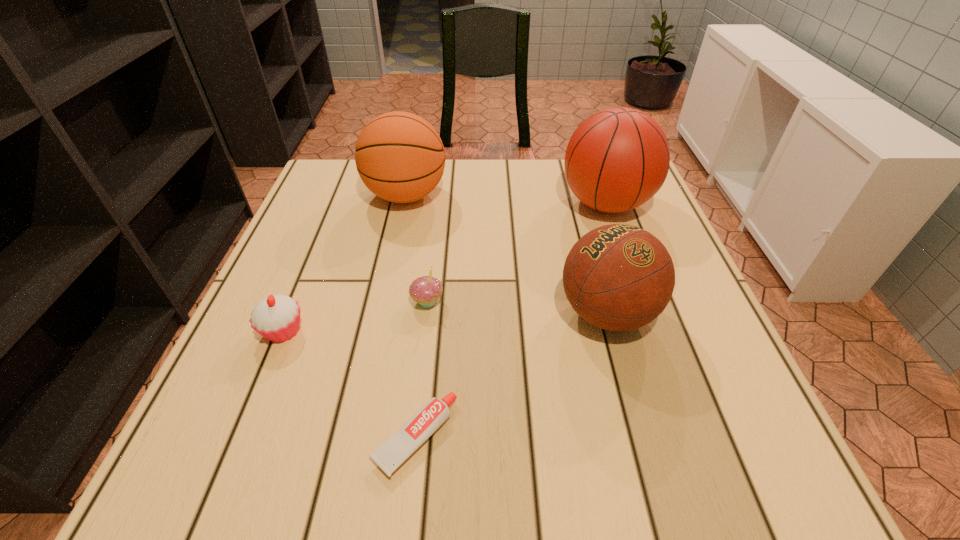
At what (x,y) coordinates should I click in order to perform the action: click on vacant region that satisfies the following two spatial constraints: 1. on the front side of the right cupcake; 2. on the right side of the toothpaste. Please return your answer as a coordinate pair (x, y). Looking at the image, I should click on (411, 437).

Locate an element on the screen. free space that satisfies the following two spatial constraints: 1. on the back side of the right cupcake; 2. on the right side of the leftmost object is located at coordinates (295, 301).